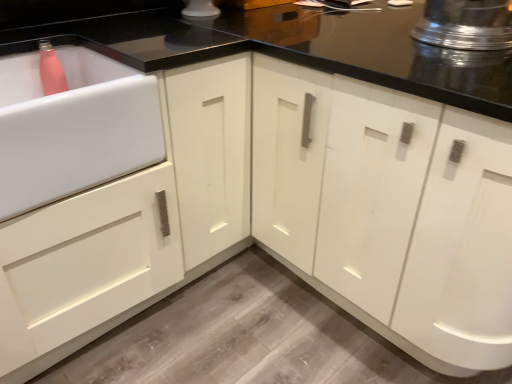
Question: Does shiny metallic pot at upper right have a greater width compared to white glossy sink at left?

Choices:
 (A) no
 (B) yes

Answer: (B)

Question: Considering the relative sizes of shiny metallic pot at upper right and white glossy sink at left in the image provided, is shiny metallic pot at upper right taller than white glossy sink at left?

Choices:
 (A) no
 (B) yes

Answer: (A)

Question: Is shiny metallic pot at upper right positioned before white glossy sink at left?

Choices:
 (A) no
 (B) yes

Answer: (A)

Question: Is shiny metallic pot at upper right to the left of white glossy sink at left from the viewer's perspective?

Choices:
 (A) no
 (B) yes

Answer: (A)

Question: From a real-world perspective, is shiny metallic pot at upper right on white glossy sink at left?

Choices:
 (A) no
 (B) yes

Answer: (B)

Question: From the image's perspective, is white glossy cabinet at center above or below white glossy sink at left?

Choices:
 (A) below
 (B) above

Answer: (B)

Question: Choose the correct answer: Is white glossy cabinet at center inside white glossy sink at left or outside it?

Choices:
 (A) outside
 (B) inside

Answer: (A)

Question: Relative to white glossy sink at left, is white glossy cabinet at center in front or behind?

Choices:
 (A) behind
 (B) front

Answer: (B)

Question: Based on their sizes in the image, would you say white glossy cabinet at center is bigger or smaller than white glossy sink at left?

Choices:
 (A) small
 (B) big

Answer: (B)

Question: Considering their positions, is white glossy cabinet at center located in front of or behind shiny metallic pot at upper right?

Choices:
 (A) front
 (B) behind

Answer: (A)

Question: Do you think white glossy cabinet at center is within shiny metallic pot at upper right, or outside of it?

Choices:
 (A) outside
 (B) inside

Answer: (A)

Question: From the image's perspective, relative to shiny metallic pot at upper right, is white glossy cabinet at center above or below?

Choices:
 (A) above
 (B) below

Answer: (B)

Question: Is point (497, 145) closer or farther from the camera than point (493, 44)?

Choices:
 (A) farther
 (B) closer

Answer: (B)

Question: Considering the positions of point click(x=495, y=29) and point click(x=446, y=332), is point click(x=495, y=29) closer or farther from the camera than point click(x=446, y=332)?

Choices:
 (A) farther
 (B) closer

Answer: (B)

Question: Is shiny metallic pot at upper right taller or shorter than white glossy cabinet at center?

Choices:
 (A) tall
 (B) short

Answer: (B)